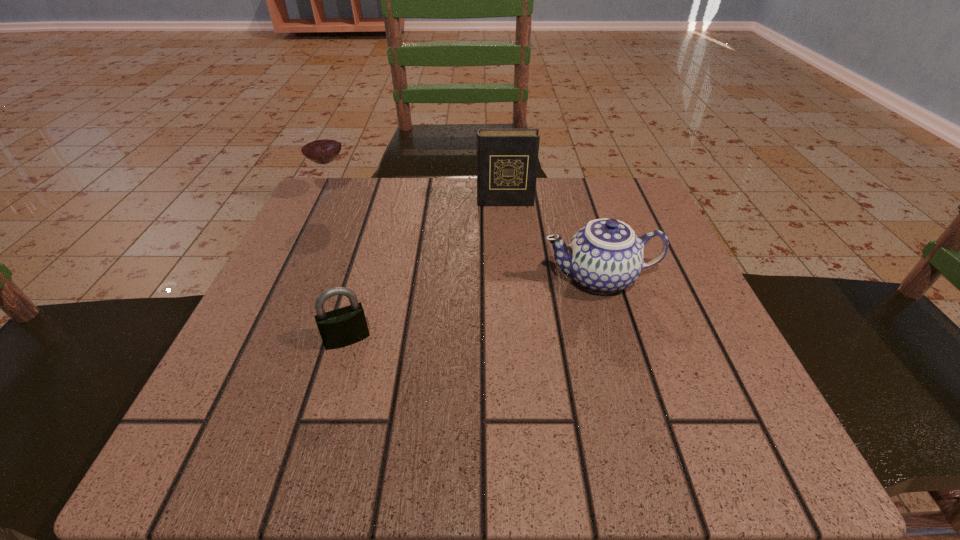
You are a GUI agent. You are given a task and a screenshot of the screen. Output one action in this format:
    pyautogui.click(x=<x>, y=<y>)
    Task: Click on the free spot located on the right of the third object from right to left
    This screenshot has width=960, height=540.
    Given the screenshot: What is the action you would take?
    pyautogui.click(x=472, y=339)

Find the location of a particular element. The image size is (960, 540). diary that is positioned at the far edge is located at coordinates (507, 159).

Where is `wineglass at the far edge`? This screenshot has width=960, height=540. wineglass at the far edge is located at coordinates (320, 144).

You are a GUI agent. You are given a task and a screenshot of the screen. Output one action in this format:
    pyautogui.click(x=<x>, y=<y>)
    Task: Click on the wineglass located in the left edge section of the desktop
    
    Given the screenshot: What is the action you would take?
    pyautogui.click(x=320, y=144)

Where is `padlock that is at the left edge`? The image size is (960, 540). padlock that is at the left edge is located at coordinates (345, 326).

Locate an element on the screen. object that is at the right edge is located at coordinates (605, 256).

At what (x,y) coordinates should I click in order to perform the action: click on object located in the far left corner section of the desktop. Please return your answer as a coordinate pair (x, y). The image size is (960, 540). Looking at the image, I should click on (320, 144).

This screenshot has width=960, height=540. In the image, there is a desktop. Identify the location of vacant space at the far edge. (461, 238).

Where is `vacant space at the near edge of the desktop`? Image resolution: width=960 pixels, height=540 pixels. vacant space at the near edge of the desktop is located at coordinates (403, 444).

At what (x,y) coordinates should I click in order to perform the action: click on free space at the left edge. Please return your answer as a coordinate pair (x, y). This screenshot has width=960, height=540. Looking at the image, I should click on (300, 338).